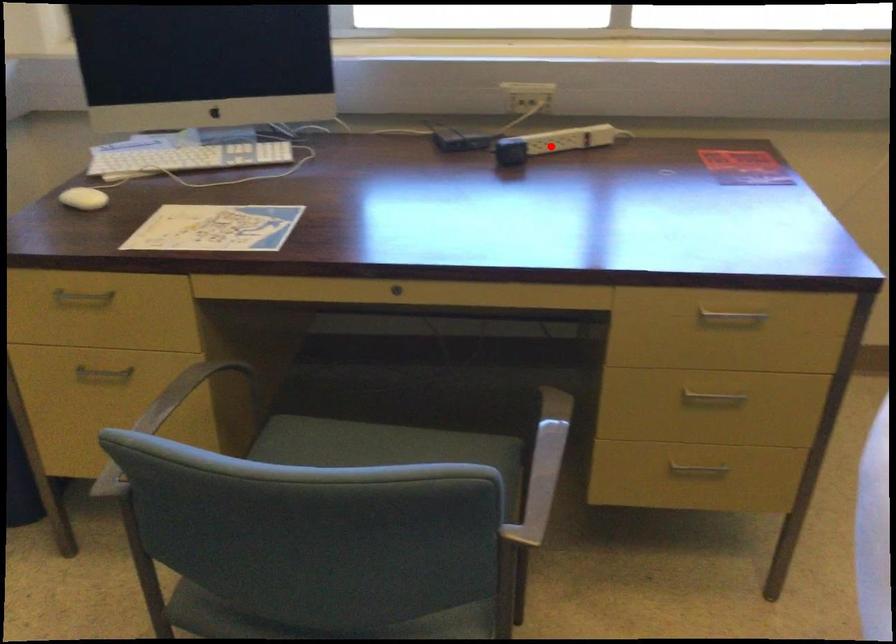
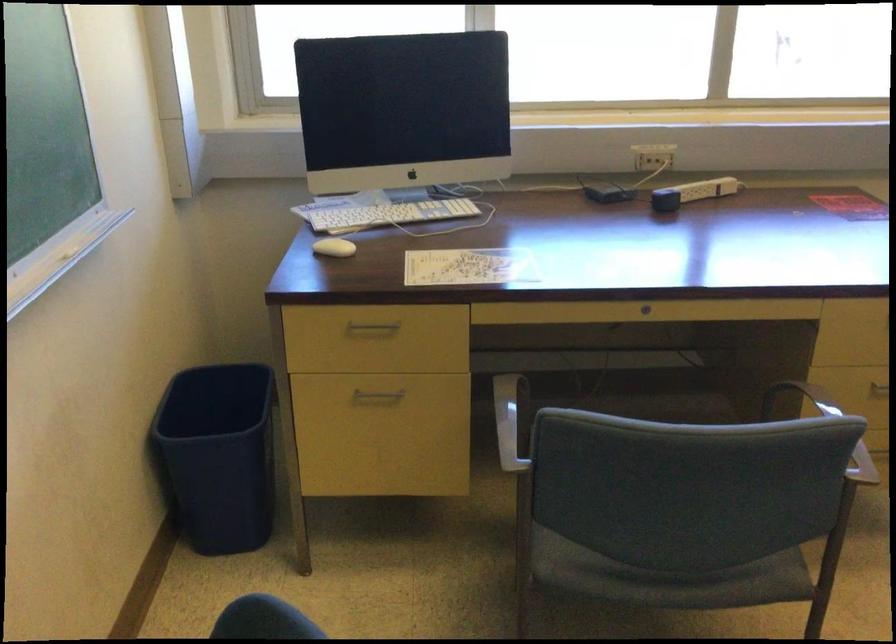
Locate, in the second image, the point that corresponds to the highlighted location in the first image.

(692, 193)